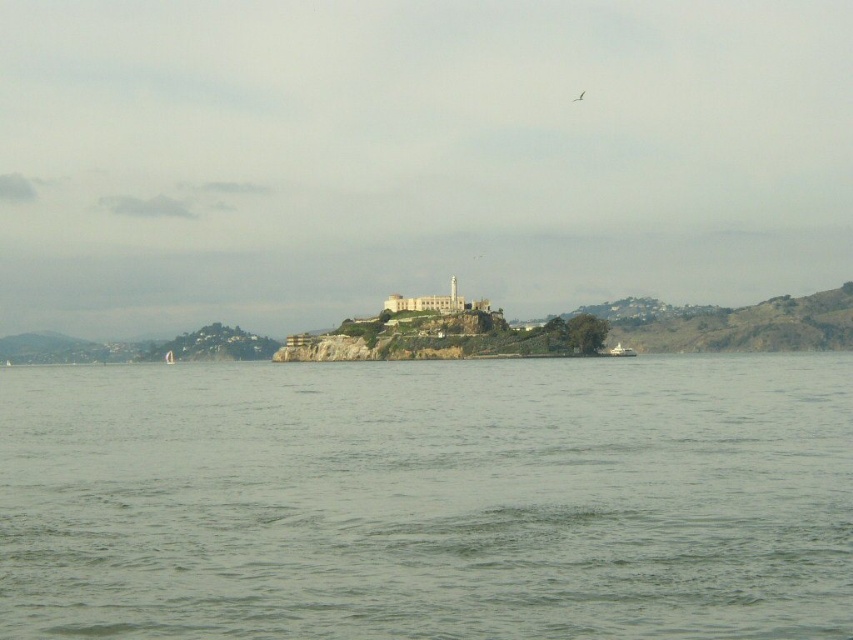
You are a photographer trying to capture the white stone castle at center and the white matte boat at center in a single shot. Which object will appear larger in the photo?

The white stone castle at center will appear larger in the photo because it has a greater height compared to the white matte boat at center.

You are standing on a boat in the middle of the gray water at center and want to reach the white stone castle at center. Which direction should you move to get closer to the castle?

The gray water at center is below the white stone castle at center, so you should move upward from the gray water at center to reach the white stone castle at center.